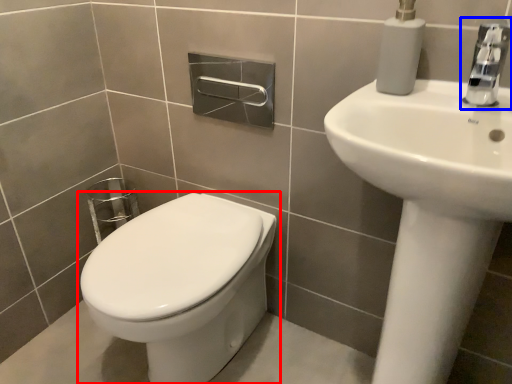
Question: Which of the following is the closest to the observer, toilet (highlighted by a red box) or tap (highlighted by a blue box)?

Choices:
 (A) toilet
 (B) tap

Answer: (B)